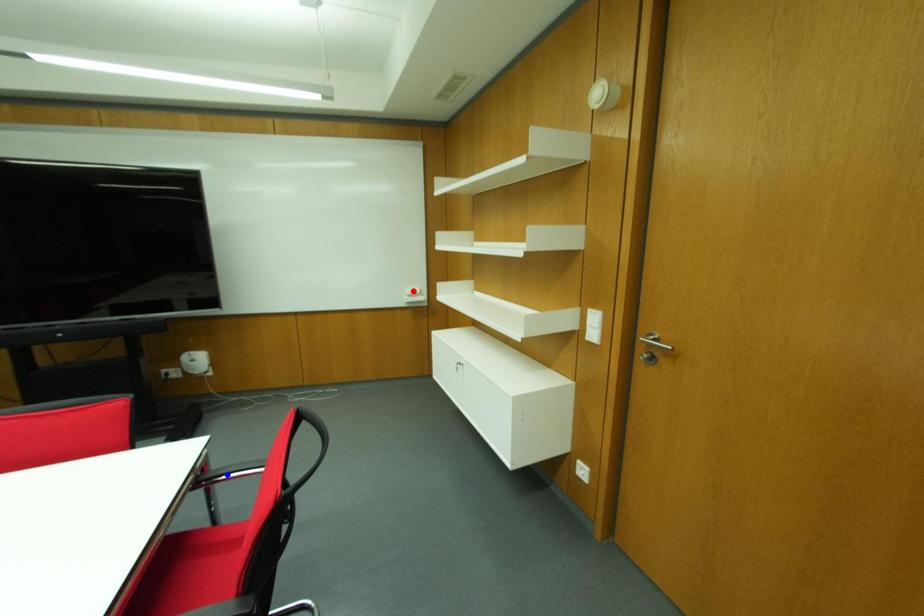
Question: In the image, two points are highlighted. Which point is nearer to the camera? Reply with the corresponding letter.

Choices:
 (A) blue point
 (B) red point

Answer: (A)